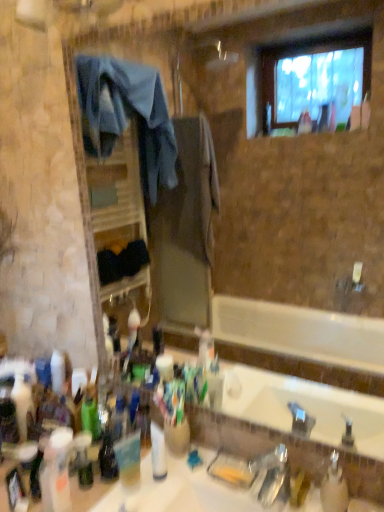
Locate an element on the screen. This screenshot has width=384, height=512. free point to the right of white glossy bottle at center, which is the third bottle from back to front is located at coordinates (201, 486).